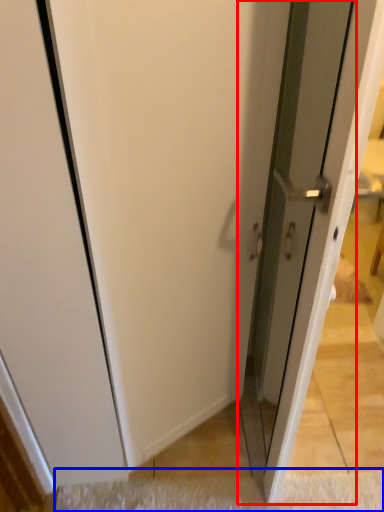
Question: Which object appears farthest to the camera in this image, screen door (highlighted by a red box) or doormat (highlighted by a blue box)?

Choices:
 (A) screen door
 (B) doormat

Answer: (B)